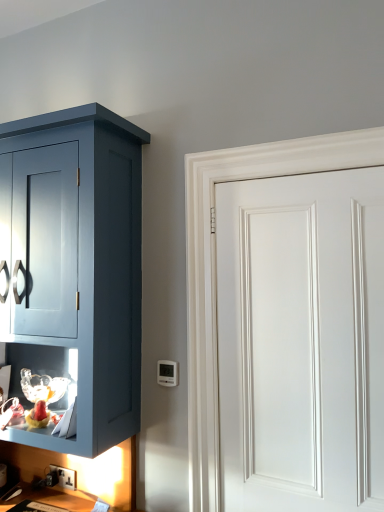
Question: Is white plastic thermostat at lower center bigger than black plastic electric outlet at lower left?

Choices:
 (A) yes
 (B) no

Answer: (A)

Question: Is white plastic thermostat at lower center far from black plastic electric outlet at lower left?

Choices:
 (A) no
 (B) yes

Answer: (A)

Question: Is white plastic thermostat at lower center wider than black plastic electric outlet at lower left?

Choices:
 (A) yes
 (B) no

Answer: (A)

Question: Is the position of white plastic thermostat at lower center less distant than that of black plastic electric outlet at lower left?

Choices:
 (A) yes
 (B) no

Answer: (A)

Question: From the image's perspective, is white plastic thermostat at lower center above black plastic electric outlet at lower left?

Choices:
 (A) yes
 (B) no

Answer: (A)

Question: Does white plastic thermostat at lower center turn towards black plastic electric outlet at lower left?

Choices:
 (A) no
 (B) yes

Answer: (A)

Question: Is black plastic electric outlet at lower left wider than white smooth door at right?

Choices:
 (A) yes
 (B) no

Answer: (B)

Question: Is black plastic electric outlet at lower left not inside white smooth door at right?

Choices:
 (A) yes
 (B) no

Answer: (A)

Question: Considering the relative sizes of black plastic electric outlet at lower left and white smooth door at right in the image provided, is black plastic electric outlet at lower left thinner than white smooth door at right?

Choices:
 (A) yes
 (B) no

Answer: (A)

Question: Does black plastic electric outlet at lower left appear on the right side of white smooth door at right?

Choices:
 (A) no
 (B) yes

Answer: (A)

Question: Is black plastic electric outlet at lower left further to camera compared to white smooth door at right?

Choices:
 (A) no
 (B) yes

Answer: (B)

Question: From a real-world perspective, is black plastic electric outlet at lower left over white smooth door at right?

Choices:
 (A) yes
 (B) no

Answer: (B)

Question: Can you confirm if white plastic thermostat at lower center is positioned to the left of white smooth door at right?

Choices:
 (A) no
 (B) yes

Answer: (B)